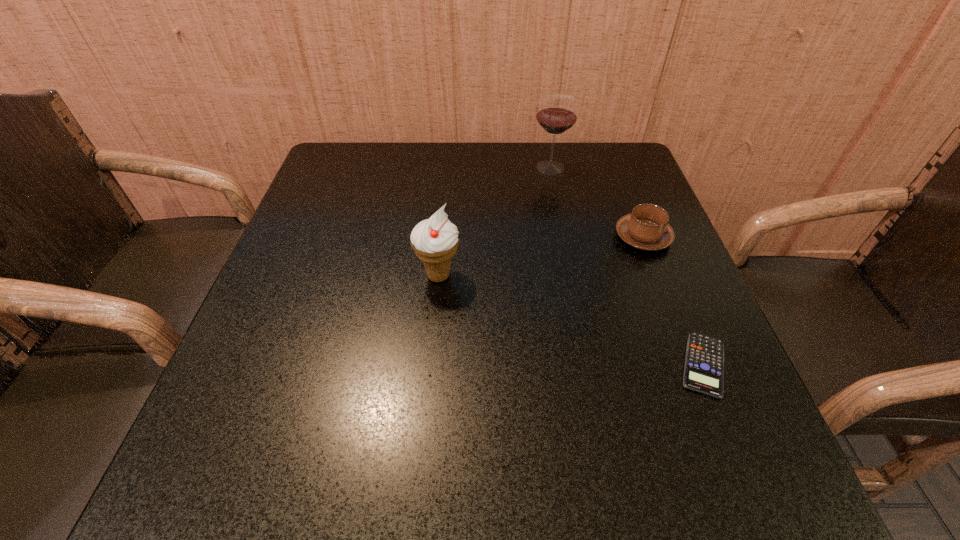
The width and height of the screenshot is (960, 540). I want to click on free location at the far left corner, so click(375, 179).

This screenshot has width=960, height=540. Find the location of `free spot at the far right corner of the desktop`. free spot at the far right corner of the desktop is located at coordinates (617, 141).

Where is `vacant area at the near right corner`? The image size is (960, 540). vacant area at the near right corner is located at coordinates (734, 472).

Find the location of `vacant area between the third farthest object and the second farthest object`. vacant area between the third farthest object and the second farthest object is located at coordinates (540, 256).

Where is `blank region between the calculator and the third tallest object`? This screenshot has width=960, height=540. blank region between the calculator and the third tallest object is located at coordinates (673, 301).

Identify the location of vacant space that is in between the second shortest object and the wineglass. (596, 202).

Where is `unoccupied position between the nearest object and the farthest object`? Image resolution: width=960 pixels, height=540 pixels. unoccupied position between the nearest object and the farthest object is located at coordinates (627, 266).

Where is `free space between the shortest object and the third tallest object`? The width and height of the screenshot is (960, 540). free space between the shortest object and the third tallest object is located at coordinates point(673,301).

Identify the location of vacant space in between the cappuccino and the shortest object. (673, 301).

Locate an element on the screen. free area in between the cappuccino and the calculator is located at coordinates (673, 301).